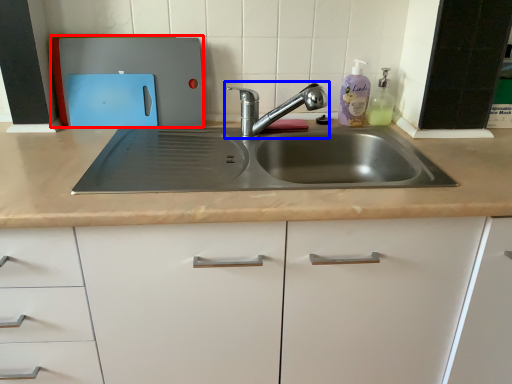
Question: Which object appears closest to the camera in this image, appliance (highlighted by a red box) or tap (highlighted by a blue box)?

Choices:
 (A) appliance
 (B) tap

Answer: (B)